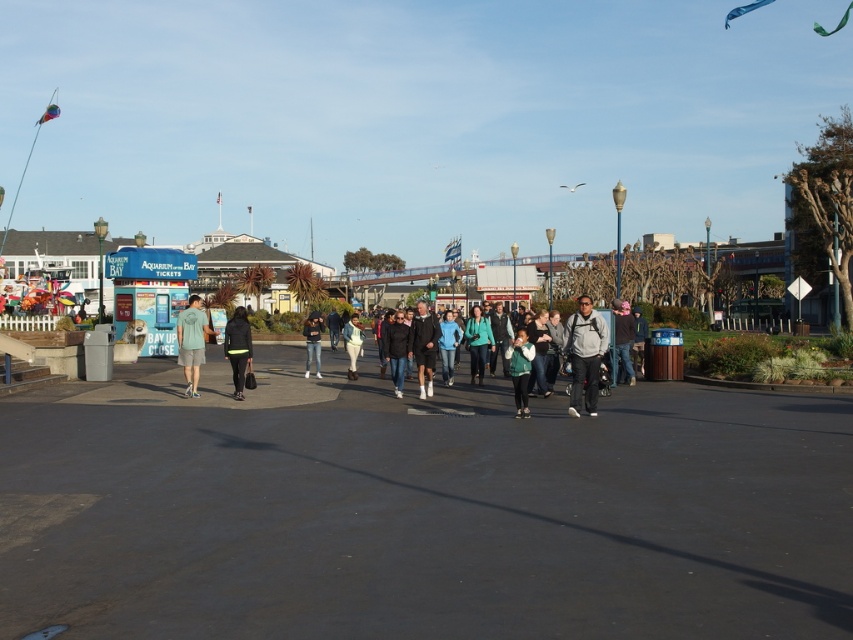
Question: Which of the following is the farthest from the observer?

Choices:
 (A) (625, 337)
 (B) (451, 360)
 (C) (399, 330)
 (D) (201, 323)

Answer: (B)

Question: Which object is closer to the camera taking this photo?

Choices:
 (A) blue denim jeans at center
 (B) teal fabric jacket at center
 (C) light blue denim jacket at center

Answer: (B)

Question: Can you confirm if green fleece jacket at center is positioned to the right of black leather jacket at center?

Choices:
 (A) yes
 (B) no

Answer: (A)

Question: From the image, what is the correct spatial relationship of teal fabric jacket at center in relation to light blue denim jacket at center?

Choices:
 (A) left
 (B) right

Answer: (B)

Question: Where is dark gray jacket at center located in relation to blue denim jeans at center in the image?

Choices:
 (A) right
 (B) left

Answer: (B)

Question: Among these objects, which one is farthest from the camera?

Choices:
 (A) neon yellow fabric pants at center
 (B) denim jacket at center
 (C) teal fabric jacket at center
 (D) gray fabric jacket at center

Answer: (B)